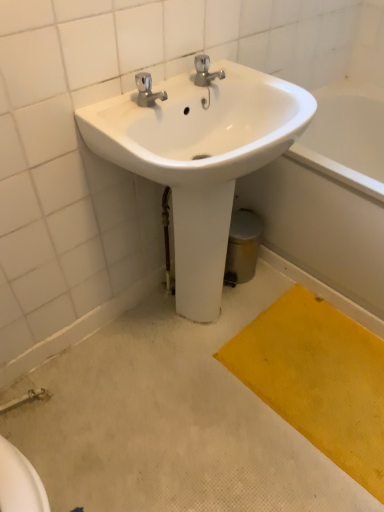
Locate an element on the screen. vacant space situated on the left part of yellow fabric doormat at lower right is located at coordinates (184, 414).